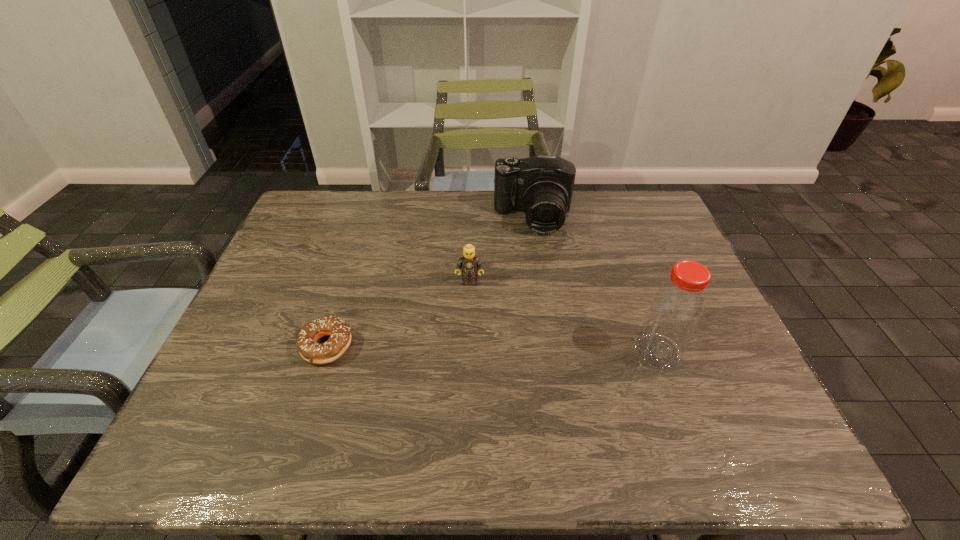
In order to click on vacant space that satisfies the following two spatial constraints: 1. on the back side of the Lego; 2. on the right side of the shortest object in this screenshot , I will do `click(348, 282)`.